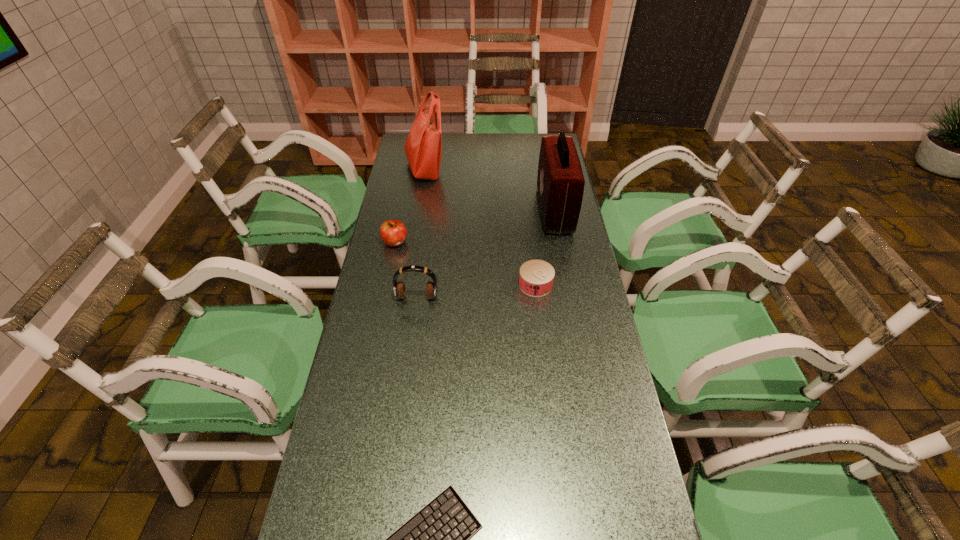
At what (x,y) coordinates should I click in order to perform the action: click on free space located 0.350m on the back of the apple. Please return your answer as a coordinate pair (x, y). Looking at the image, I should click on (408, 180).

Where is `free region located on the back of the fifth tallest object`? The image size is (960, 540). free region located on the back of the fifth tallest object is located at coordinates (533, 258).

Find the location of a particular element. This screenshot has height=540, width=960. object at the far edge is located at coordinates (423, 147).

Where is `handbag situated at the left edge`? handbag situated at the left edge is located at coordinates (423, 147).

I want to click on headset present at the left edge, so click(x=399, y=290).

At what (x,y) coordinates should I click in order to perform the action: click on apple located at the left edge. Please return your answer as a coordinate pair (x, y). This screenshot has width=960, height=540. Looking at the image, I should click on (393, 232).

The height and width of the screenshot is (540, 960). Identify the location of the first aid kit present at the right edge. (560, 182).

The height and width of the screenshot is (540, 960). What are the coordinates of `can positioned at the right edge` in the screenshot? It's located at (536, 277).

Identify the location of object that is at the far left corner. Image resolution: width=960 pixels, height=540 pixels. (423, 147).

The image size is (960, 540). Find the location of `vacant space at the left edge of the desktop`. vacant space at the left edge of the desktop is located at coordinates (359, 468).